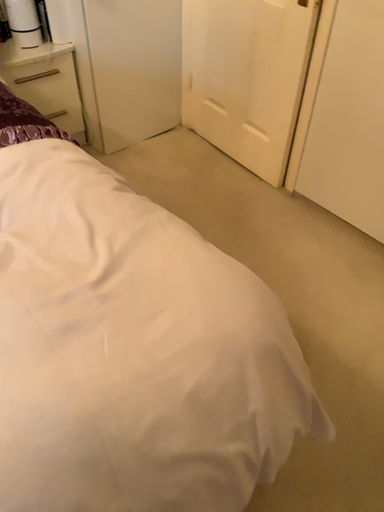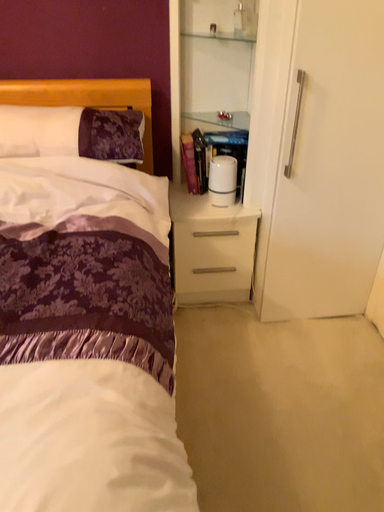
Question: How did the camera likely rotate when shooting the video?

Choices:
 (A) rotated right
 (B) rotated left

Answer: (B)